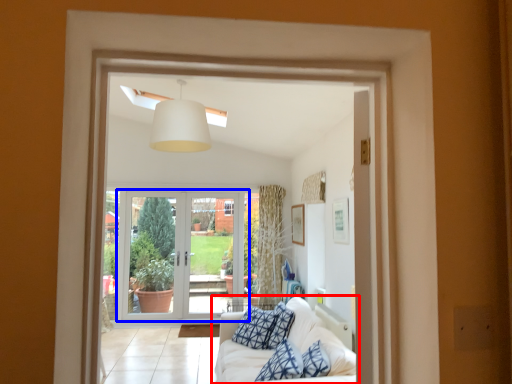
Question: Among these objects, which one is farthest to the camera, studio couch (highlighted by a red box) or door (highlighted by a blue box)?

Choices:
 (A) studio couch
 (B) door

Answer: (B)